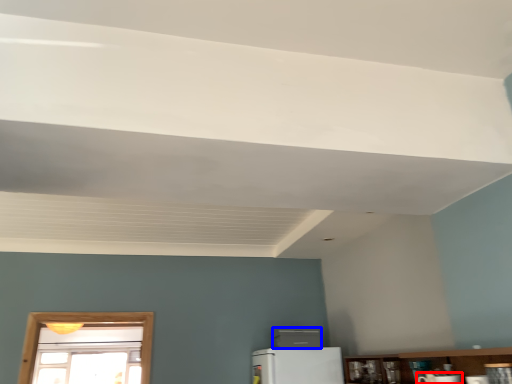
Question: Which object appears farthest to the camera in this image, appliance (highlighted by a red box) or appliance (highlighted by a blue box)?

Choices:
 (A) appliance
 (B) appliance

Answer: (B)